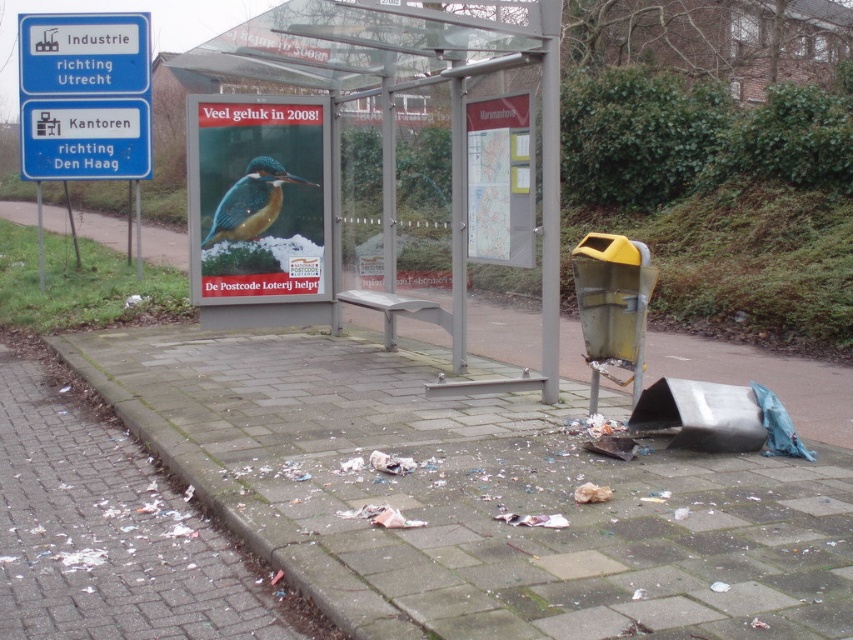
Does white brick pavement at lower left have a lesser height compared to blue plastic sign at upper left?

Yes, white brick pavement at lower left is shorter than blue plastic sign at upper left.

Which is behind, point (236, 618) or point (120, 45)?

Positioned behind is point (120, 45).

Where is `white brick pavement at lower left`? white brick pavement at lower left is located at coordinates (109, 532).

Does transparent glass bus stop at center have a smaller size compared to shiny blue-green bird at center?

No.

I want to click on transparent glass bus stop at center, so click(341, 157).

Locate an element on the screen. This screenshot has height=640, width=853. transparent glass bus stop at center is located at coordinates (341, 157).

Can you confirm if blue plastic sign at upper left is positioned to the right of shiny blue-green bird at center?

In fact, blue plastic sign at upper left is to the left of shiny blue-green bird at center.

Is point (114, 93) farther from camera compared to point (231, 236)?

Yes, point (114, 93) is farther from viewer.

Is point (128, 84) positioned before point (274, 209)?

No, (128, 84) is further to viewer.

This screenshot has height=640, width=853. Identify the location of blue plastic sign at upper left. (83, 52).